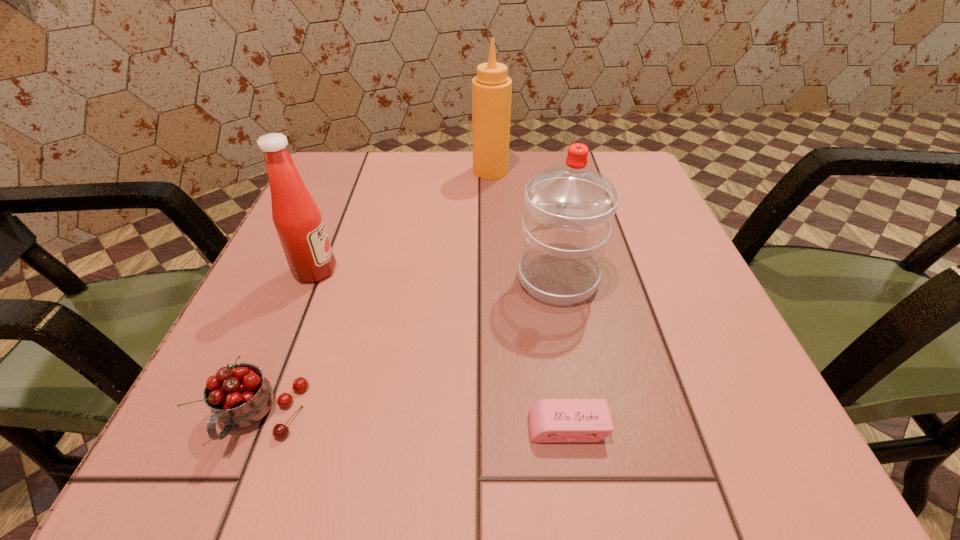
Where is `vacant space at the left edge of the desktop`? Image resolution: width=960 pixels, height=540 pixels. vacant space at the left edge of the desktop is located at coordinates (335, 292).

In the image, there is a desktop. Where is `free space at the far left corner`? This screenshot has width=960, height=540. free space at the far left corner is located at coordinates (319, 171).

I want to click on unoccupied area between the eraser and the cherry, so click(414, 422).

Locate an element on the screen. free spot between the water bottle and the eraser is located at coordinates (563, 353).

Where is `vacant space that's between the water bottle and the fourth tallest object`? The width and height of the screenshot is (960, 540). vacant space that's between the water bottle and the fourth tallest object is located at coordinates (409, 347).

This screenshot has height=540, width=960. What are the coordinates of `empty space that is in between the water bottle and the eraser` in the screenshot? It's located at (563, 353).

You are a GUI agent. You are given a task and a screenshot of the screen. Output one action in this format:
    pyautogui.click(x=<x>, y=<y>)
    Task: Click on the vacant space that's between the water bottle and the eraser
    
    Given the screenshot: What is the action you would take?
    click(563, 353)

Where is `vacant space that is in between the eraser and the water bottle`? vacant space that is in between the eraser and the water bottle is located at coordinates (563, 353).

Where is `vacant area that lies between the nearer condiment and the cherry`? The image size is (960, 540). vacant area that lies between the nearer condiment and the cherry is located at coordinates (287, 343).

The height and width of the screenshot is (540, 960). In order to click on vacant area between the farthest object and the cherry in this screenshot , I will do `click(374, 294)`.